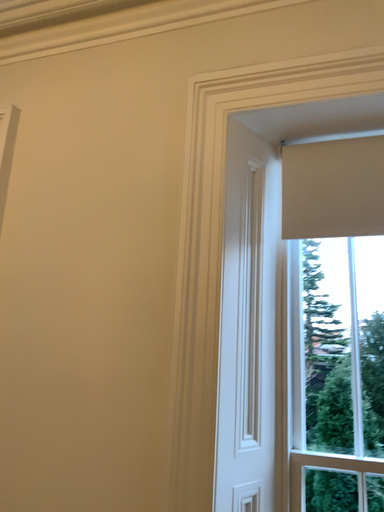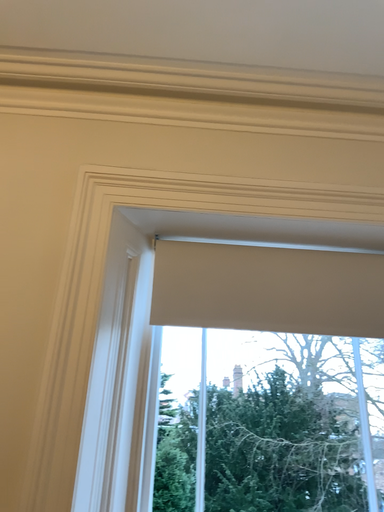
Question: Which way did the camera rotate in the video?

Choices:
 (A) rotated upward
 (B) rotated downward

Answer: (A)